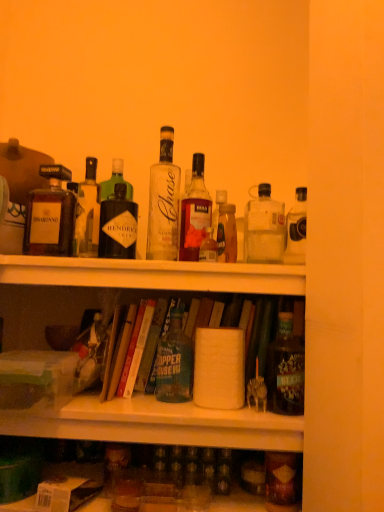
At what (x,y) coordinates should I click in order to perform the action: click on free location in front of white matte toilet paper at center. Please return your answer as a coordinate pair (x, y). Image resolution: width=384 pixels, height=512 pixels. Looking at the image, I should click on (226, 411).